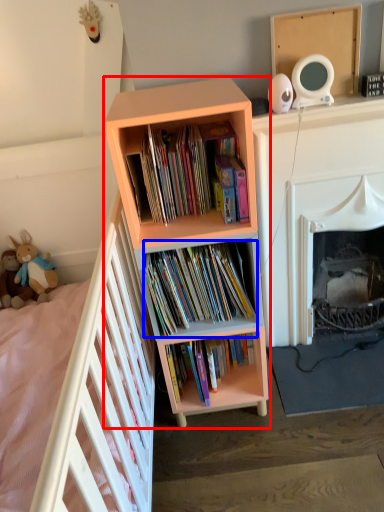
Question: Which of the following is the closest to the observer, bookcase (highlighted by a red box) or book (highlighted by a blue box)?

Choices:
 (A) bookcase
 (B) book

Answer: (A)